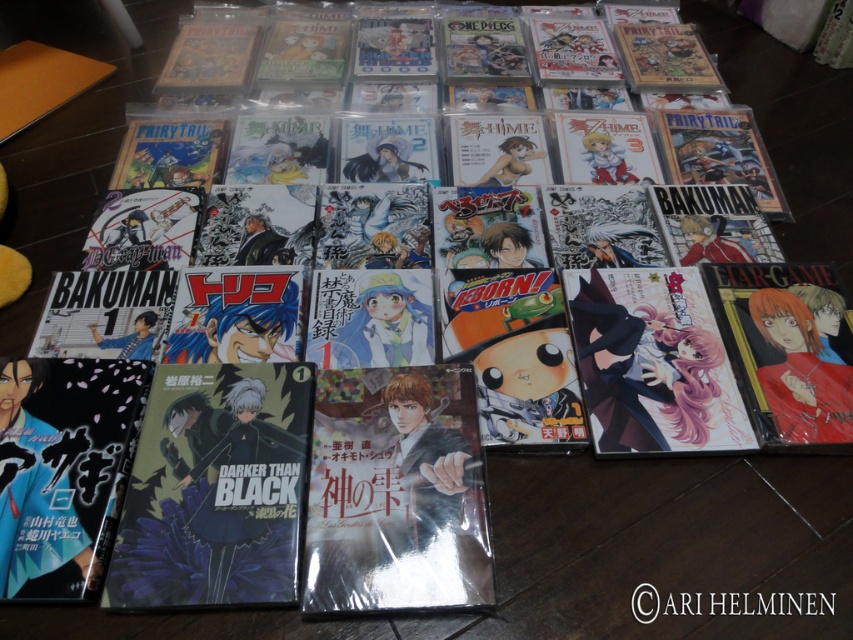
Does matte silver manga at center lie in front of matte black comic book at center?

No, matte silver manga at center is behind matte black comic book at center.

Does matte silver manga at center lie behind matte black comic book at center?

Yes, it is behind matte black comic book at center.

Does point (451, 444) come behind point (276, 433)?

Yes.

The width and height of the screenshot is (853, 640). Identify the location of matte silver manga at center. (395, 492).

Does matte black comic book at center appear on the left side of pink glossy manga at center-right?

Indeed, matte black comic book at center is positioned on the left side of pink glossy manga at center-right.

Is point (200, 445) closer to viewer compared to point (581, 294)?

That is True.

Find the location of `matte black comic book at center`. matte black comic book at center is located at coordinates (213, 490).

Does matte black manga at bottom left appear under pink glossy manga at center-right?

Indeed, matte black manga at bottom left is positioned under pink glossy manga at center-right.

Does point (6, 461) lie behind point (612, 312)?

No, it is not.

You are a GUI agent. You are given a task and a screenshot of the screen. Output one action in this format:
    pyautogui.click(x=<x>, y=<y>)
    Task: Click on the matte black manga at bottom left
    The image size is (853, 640).
    Given the screenshot: What is the action you would take?
    point(62,468)